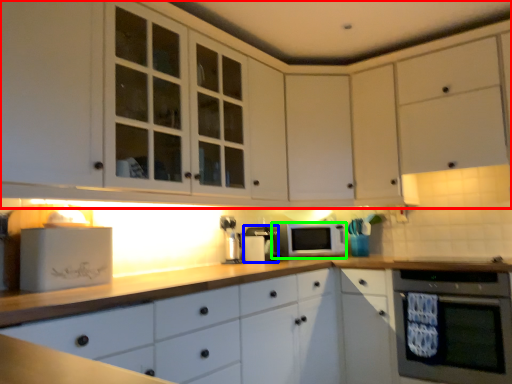
Question: Based on their relative distances, which object is farther from cabinetry (highlighted by a red box)? Choose from coffee machine (highlighted by a blue box) and microwave oven (highlighted by a green box).

Choices:
 (A) coffee machine
 (B) microwave oven

Answer: (A)